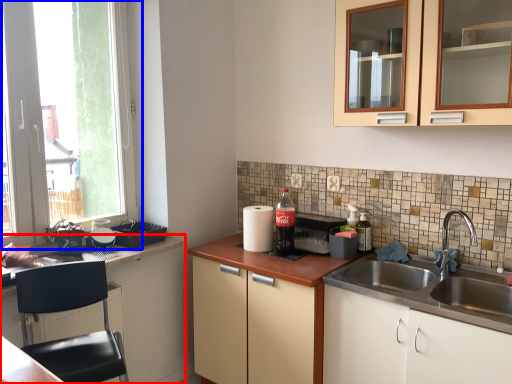
Question: Among these objects, which one is farthest to the camera, cabinetry (highlighted by a red box) or window (highlighted by a blue box)?

Choices:
 (A) cabinetry
 (B) window

Answer: (B)